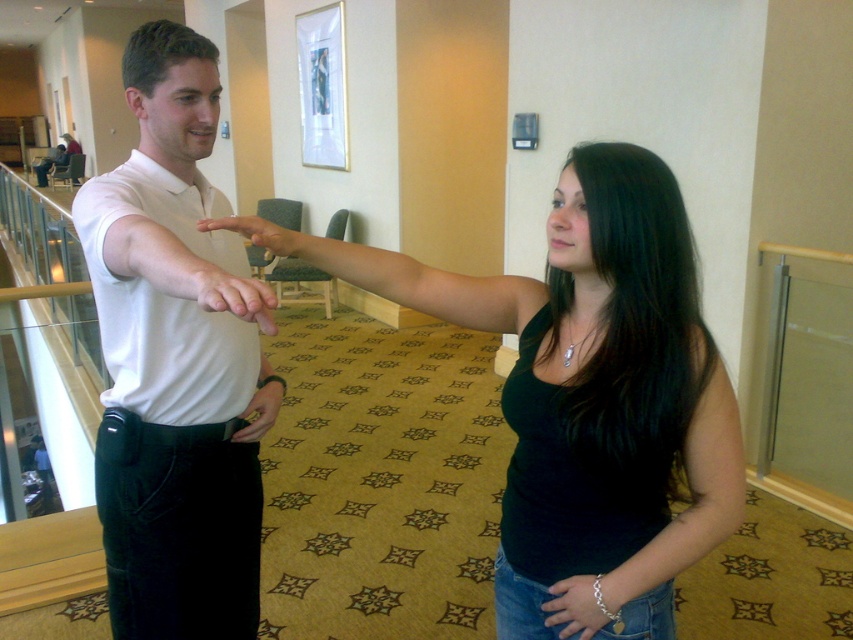
Question: Which of the following is the farthest from the observer?

Choices:
 (A) (549, 621)
 (B) (569, 218)

Answer: (A)

Question: Is matte white hand at center positioned before matte skin hand at center?

Choices:
 (A) yes
 (B) no

Answer: (A)

Question: Which object is positioned closest to the silver metallic bracelet at lower center?

Choices:
 (A) white matte shirt at center
 (B) black matte tank top at center

Answer: (B)

Question: Is black matte tank top at center behind matte white hand at center?

Choices:
 (A) no
 (B) yes

Answer: (B)

Question: Can you confirm if black matte tank top at center is smaller than white matte shirt at center?

Choices:
 (A) no
 (B) yes

Answer: (B)

Question: Which object appears farthest from the camera in this image?

Choices:
 (A) matte skin hand at center
 (B) white matte shirt at center

Answer: (A)